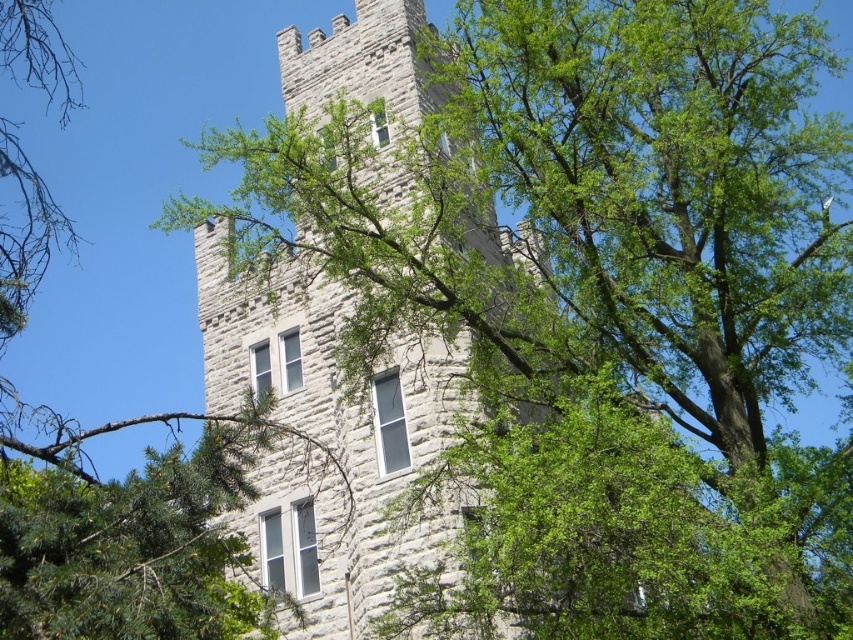
Question: Can you confirm if gray stone tower at center is positioned to the right of green leafy tree at center?

Choices:
 (A) yes
 (B) no

Answer: (A)

Question: Is gray stone tower at center bigger than green leafy tree at center?

Choices:
 (A) no
 (B) yes

Answer: (B)

Question: Can you confirm if gray stone tower at center is positioned to the right of green leafy tree at center?

Choices:
 (A) yes
 (B) no

Answer: (A)

Question: Which point is farther to the camera?

Choices:
 (A) green leafy tree at center
 (B) gray stone tower at center

Answer: (A)

Question: Which point is farther to the camera?

Choices:
 (A) (373, 401)
 (B) (114, 285)

Answer: (B)